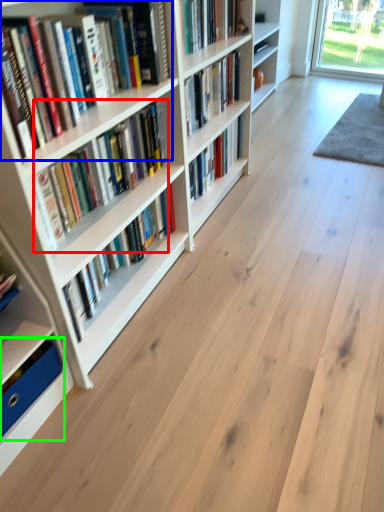
Question: Estimate the real-world distances between objects in this image. Which object is closer to book (highlighted by a red box), book (highlighted by a blue box) or book (highlighted by a green box)?

Choices:
 (A) book
 (B) book

Answer: (A)